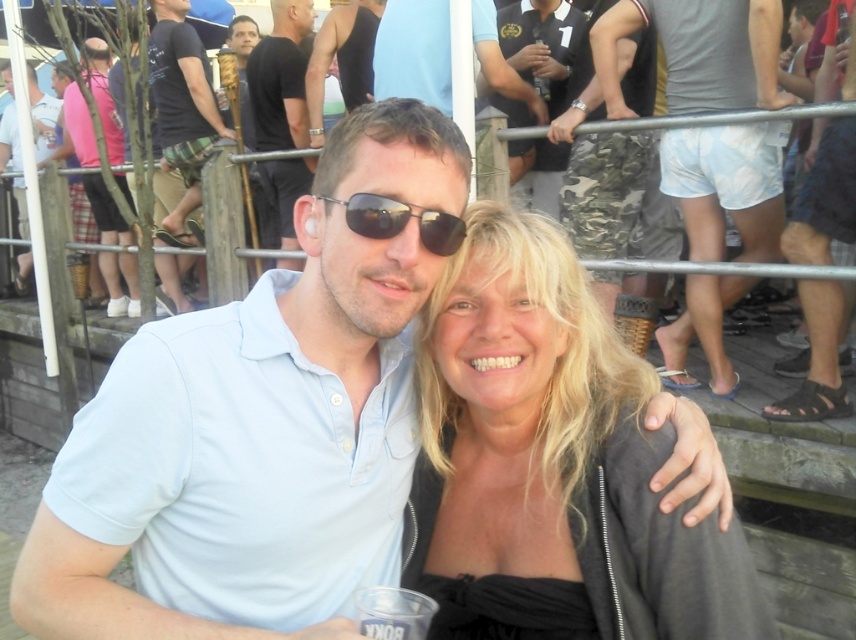
Question: Which is farther from the black leather sandals at right?

Choices:
 (A) white cotton shorts at upper right
 (B) black cotton t-shirt at upper left
 (C) camouflage shorts at center

Answer: (B)

Question: Observing the image, what is the correct spatial positioning of light blue shirt at center in reference to matte black shirt at left?

Choices:
 (A) above
 (B) below

Answer: (B)

Question: Can you confirm if blonde hair at center is wider than white cotton shorts at upper right?

Choices:
 (A) no
 (B) yes

Answer: (A)

Question: In this image, where is light blue shirt at center located relative to matte black sunglasses at center?

Choices:
 (A) right
 (B) left

Answer: (B)

Question: Which object appears farthest from the camera in this image?

Choices:
 (A) black matte tank top at upper center
 (B) camouflage shorts at center
 (C) matte black sunglasses at center

Answer: (A)

Question: Estimate the real-world distances between objects in this image. Which object is closer to the black cotton t-shirt at upper left?

Choices:
 (A) matte black polo shirt at upper center
 (B) black matte shirt at center
 (C) blonde hair at center
 (D) black matte tank top at upper center

Answer: (B)